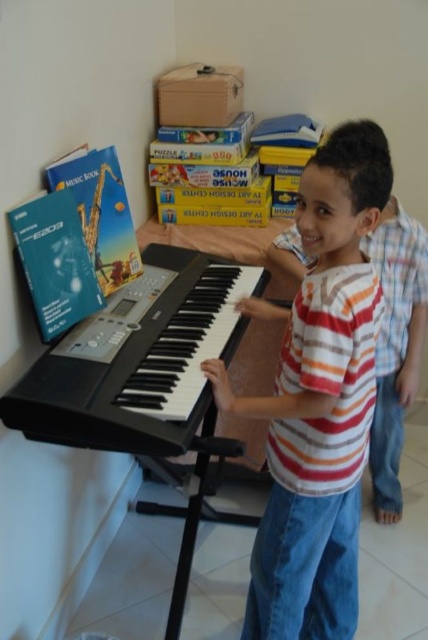
Can you confirm if striped cotton shirt at center is wider than black matte keyboard at center?

In fact, striped cotton shirt at center might be narrower than black matte keyboard at center.

Is striped cotton shirt at center below black matte keyboard at center?

Yes, striped cotton shirt at center is below black matte keyboard at center.

Locate an element on the screen. Image resolution: width=428 pixels, height=640 pixels. striped cotton shirt at center is located at coordinates (320, 401).

Locate an element on the screen. striped cotton shirt at center is located at coordinates (320, 401).